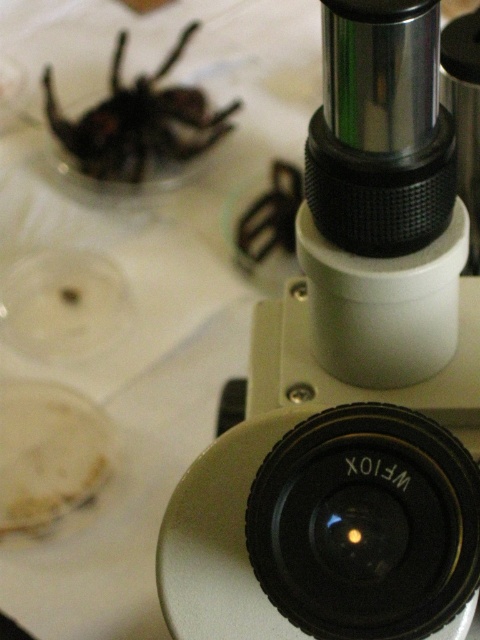
Does point (337, 525) come in front of point (45, 83)?

Yes.

What do you see at coordinates (365, 524) in the screenshot? I see `black plastic lens at center` at bounding box center [365, 524].

Is point (417, 616) farther from viewer compared to point (175, 60)?

No, (417, 616) is closer to viewer.

Find the location of a particular element. This screenshot has width=480, height=640. black plastic lens at center is located at coordinates [365, 524].

Which of these two, black plastic microscope at upper right or shiny black spider at upper left, stands taller?

Standing taller between the two is black plastic microscope at upper right.

Is black plastic microscope at upper right thinner than shiny black spider at upper left?

Yes.

Which is behind, point (432, 625) or point (164, 72)?

The point (164, 72) is behind.

At what (x,y) coordinates should I click in order to perform the action: click on black plastic microscope at upper right. Please return your answer as a coordinate pair (x, y). The width and height of the screenshot is (480, 640). Looking at the image, I should click on (350, 380).

Who is positioned more to the right, black plastic microscope at upper right or black plastic lens at center?

From the viewer's perspective, black plastic microscope at upper right appears more on the right side.

What do you see at coordinates (350, 380) in the screenshot? This screenshot has width=480, height=640. I see `black plastic microscope at upper right` at bounding box center [350, 380].

Between point (420, 470) and point (462, 520), which one is positioned in front?

Point (462, 520) is in front.

The height and width of the screenshot is (640, 480). What are the coordinates of `black plastic microscope at upper right` in the screenshot? It's located at (350, 380).